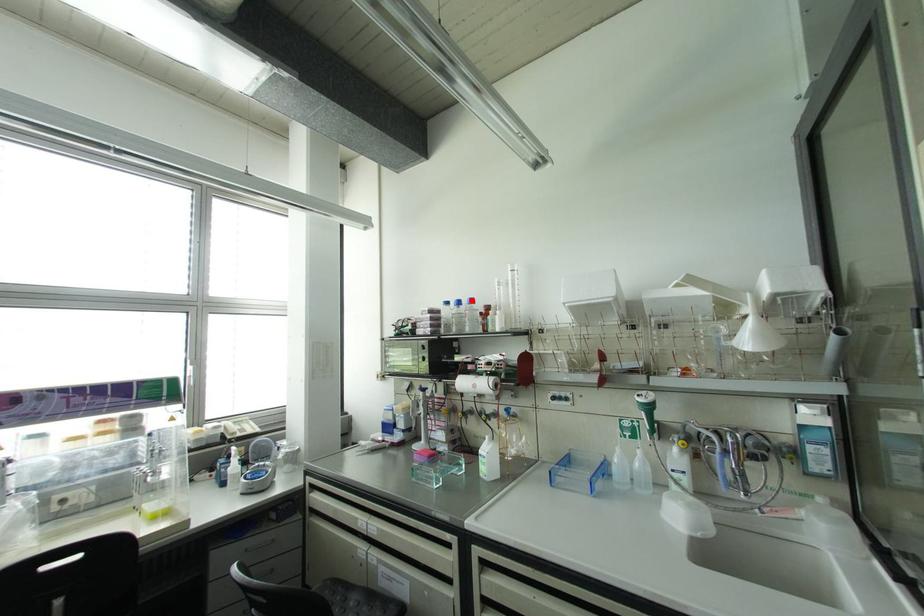
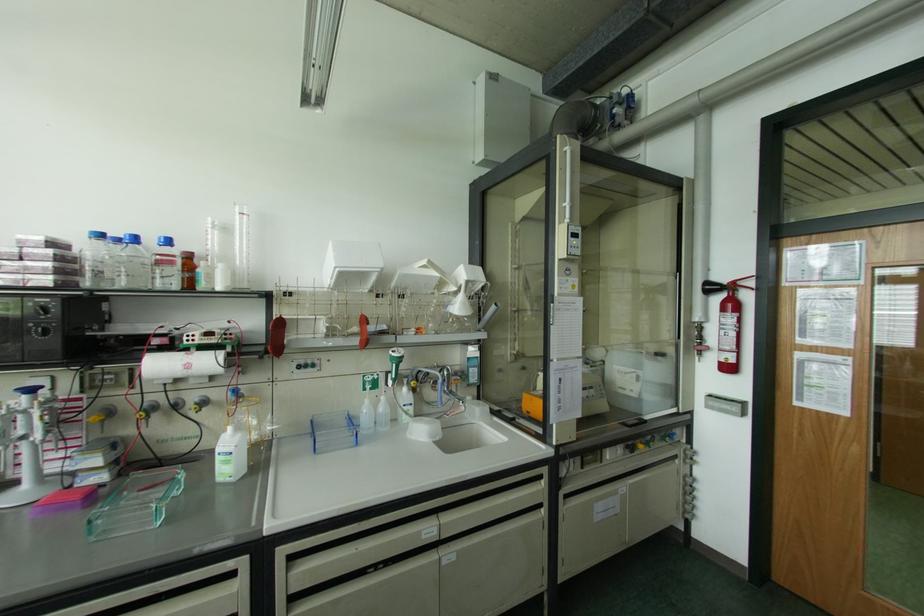
Where in the second image is the point corresponding to the highlighted location from the first image?

(167, 241)